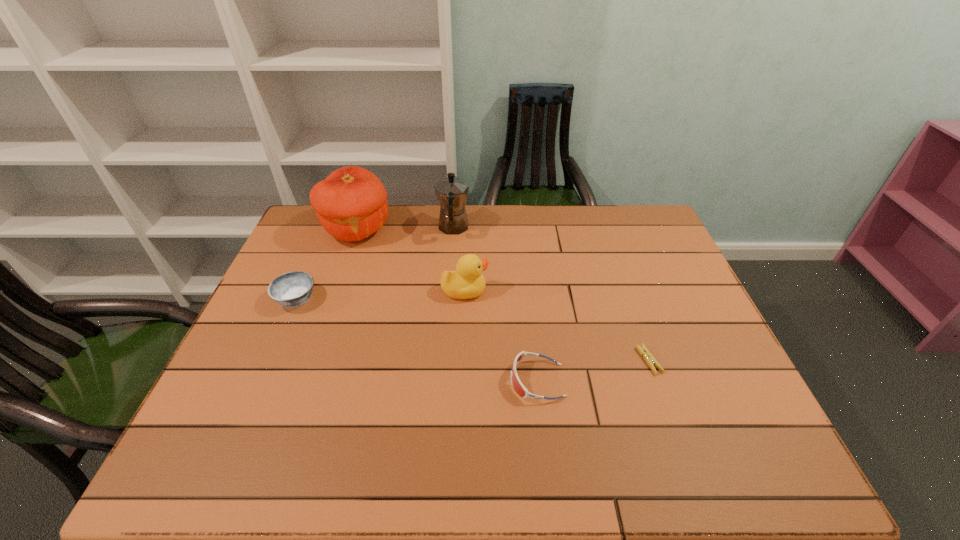
Locate an element on the screen. Image resolution: width=960 pixels, height=540 pixels. free spot at the near edge of the desktop is located at coordinates (372, 447).

In the image, there is a desktop. Identify the location of vacant space at the left edge. The width and height of the screenshot is (960, 540). (324, 271).

What are the coordinates of `vacant space at the right edge of the desktop` in the screenshot? It's located at (692, 387).

Locate an element on the screen. This screenshot has width=960, height=540. free space at the far left corner of the desktop is located at coordinates (302, 233).

Identify the location of free space at the near left corner. This screenshot has height=540, width=960. (225, 459).

Where is `vacant area at the far right corner of the desktop`? Image resolution: width=960 pixels, height=540 pixels. vacant area at the far right corner of the desktop is located at coordinates (660, 241).

In the image, there is a desktop. Where is `vacant space at the near right corner`? This screenshot has height=540, width=960. vacant space at the near right corner is located at coordinates (732, 459).

The image size is (960, 540). I want to click on vacant area that lies between the ashtray and the goggles, so click(x=417, y=340).

In order to click on vacant area that lies between the shortest object and the ashtray in this screenshot , I will do `click(472, 330)`.

In order to click on vacant area that lies between the ashtray and the pumpkin in this screenshot , I will do `click(326, 264)`.